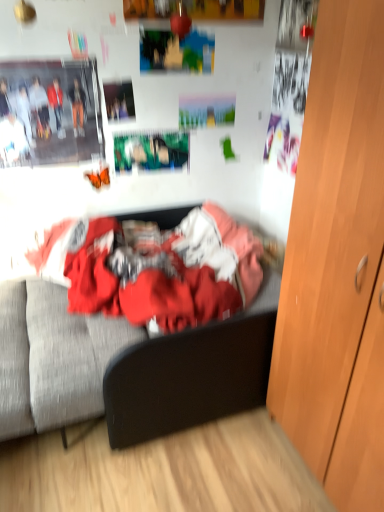
At what (x,y) coordinates should I click in order to perform the action: click on wooden cabinet at right. Please return your answer as a coordinate pair (x, y). The height and width of the screenshot is (512, 384). Looking at the image, I should click on point(337,265).

Describe the element at coordinates (337, 265) in the screenshot. I see `wooden cabinet at right` at that location.

What do you see at coordinates (126, 366) in the screenshot? I see `textured fabric bed at center` at bounding box center [126, 366].

The height and width of the screenshot is (512, 384). In order to click on textured fabric bed at center in this screenshot , I will do `click(126, 366)`.

Image resolution: width=384 pixels, height=512 pixels. In order to click on wooden cabinet at right in this screenshot , I will do (337, 265).

Visually, is textured fabric bed at center positioned to the left or to the right of wooden cabinet at right?

Clearly, textured fabric bed at center is on the left of wooden cabinet at right in the image.

Between textured fabric bed at center and wooden cabinet at right, which one is positioned in front?

wooden cabinet at right is more forward.

Is point (22, 400) positioned behind point (347, 507)?

Yes, point (22, 400) is farther from viewer.

From the image's perspective, which is below, textured fabric bed at center or wooden cabinet at right?

wooden cabinet at right appears lower in the image.

From a real-world perspective, is textured fabric bed at center under wooden cabinet at right?

Correct, in the physical world, textured fabric bed at center is lower than wooden cabinet at right.

Considering the sizes of objects textured fabric bed at center and wooden cabinet at right in the image provided, who is thinner, textured fabric bed at center or wooden cabinet at right?

Thinner between the two is wooden cabinet at right.

Between textured fabric bed at center and wooden cabinet at right, which one has less height?

textured fabric bed at center is shorter.

Considering the relative sizes of textured fabric bed at center and wooden cabinet at right in the image provided, is textured fabric bed at center smaller than wooden cabinet at right?

Correct, textured fabric bed at center occupies less space than wooden cabinet at right.

Is textured fabric bed at center not inside wooden cabinet at right?

Yes, textured fabric bed at center is located beyond the bounds of wooden cabinet at right.

Is textured fabric bed at center placed right next to wooden cabinet at right?

No, textured fabric bed at center is not beside wooden cabinet at right.

Is textured fabric bed at center facing towards wooden cabinet at right?

No, textured fabric bed at center is not aimed at wooden cabinet at right.

Can you tell me how much textured fabric bed at center and wooden cabinet at right differ in facing direction?

The angular difference between textured fabric bed at center and wooden cabinet at right is 93.4 degrees.

This screenshot has width=384, height=512. In order to click on bed above the wooden cabinet at right (from the image's perspective) in this screenshot , I will do `click(126, 366)`.

Considering the positions of objects wooden cabinet at right and textured fabric bed at center in the image provided, who is more to the right, wooden cabinet at right or textured fabric bed at center?

Positioned to the right is wooden cabinet at right.

Considering the relative positions of wooden cabinet at right and textured fabric bed at center in the image provided, is wooden cabinet at right behind textured fabric bed at center?

No.

Does point (376, 64) lie behind point (240, 395)?

That is False.

From the image's perspective, is wooden cabinet at right on top of textured fabric bed at center?

No, from the image's perspective, wooden cabinet at right is not on top of textured fabric bed at center.

From a real-world perspective, between wooden cabinet at right and textured fabric bed at center, who is vertically lower?

textured fabric bed at center.

Does wooden cabinet at right have a greater width compared to textured fabric bed at center?

No.

In the scene shown: Considering the sizes of objects wooden cabinet at right and textured fabric bed at center in the image provided, who is shorter, wooden cabinet at right or textured fabric bed at center?

textured fabric bed at center.

Between wooden cabinet at right and textured fabric bed at center, which one has larger size?

Bigger between the two is wooden cabinet at right.

Is textured fabric bed at center surrounded by wooden cabinet at right?

No, textured fabric bed at center is not surrounded by wooden cabinet at right.

Consider the image. Are wooden cabinet at right and textured fabric bed at center making contact?

They are not placed beside each other.

Is wooden cabinet at right looking in the opposite direction of textured fabric bed at center?

No, wooden cabinet at right's orientation is not away from textured fabric bed at center.

Find the location of a particular element. The image size is (384, 512). bed that is under the wooden cabinet at right (from a real-world perspective) is located at coordinates click(126, 366).

Find the location of a particular element. Image resolution: width=384 pixels, height=512 pixels. bed above the wooden cabinet at right (from the image's perspective) is located at coordinates (126, 366).

Find the location of a particular element. This screenshot has width=384, height=512. bed below the wooden cabinet at right (from a real-world perspective) is located at coordinates (126, 366).